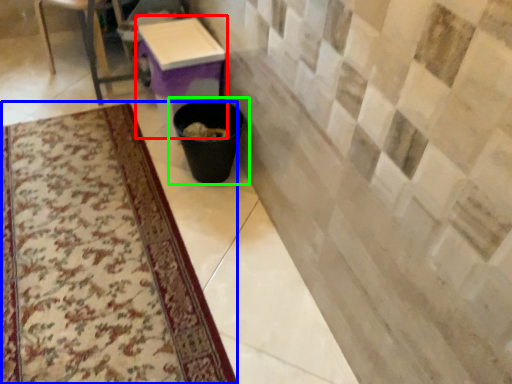
Question: Which object is the farthest from table (highlighted by a red box)? Choose among these: mat (highlighted by a blue box) or waste container (highlighted by a green box).

Choices:
 (A) mat
 (B) waste container

Answer: (A)